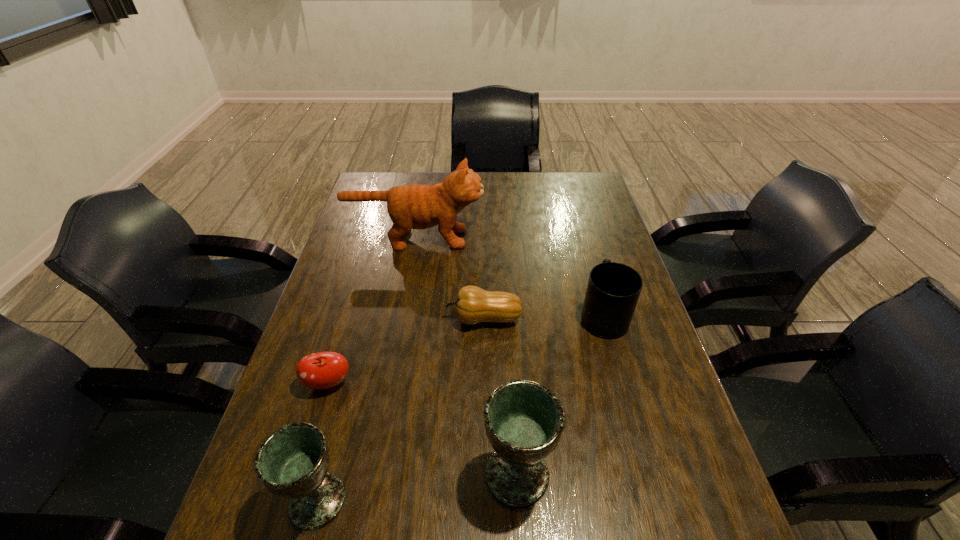
The image size is (960, 540). In order to click on free space at the far right corner of the desktop in this screenshot , I will do `click(590, 184)`.

Image resolution: width=960 pixels, height=540 pixels. I want to click on empty location between the left chalice and the right chalice, so click(418, 487).

I want to click on empty space between the fourth shortest object and the gourd, so click(x=400, y=409).

Identify the location of vacant area that lies between the left chalice and the gourd. This screenshot has width=960, height=540. (400, 409).

Identify the location of free space between the third shortest object and the third tallest object. This screenshot has width=960, height=540. (460, 408).

Identify the location of vacant space that's between the farthest object and the fifth shortest object. (467, 356).

The width and height of the screenshot is (960, 540). I want to click on free point between the fourth shortest object and the mug, so click(460, 408).

This screenshot has height=540, width=960. I want to click on free space between the third nearest object and the rightmost object, so click(x=466, y=349).

Identify the location of free area in between the gourd and the mug. click(x=543, y=317).

The height and width of the screenshot is (540, 960). Identify the location of vacant area between the tallest object and the apple. (372, 311).